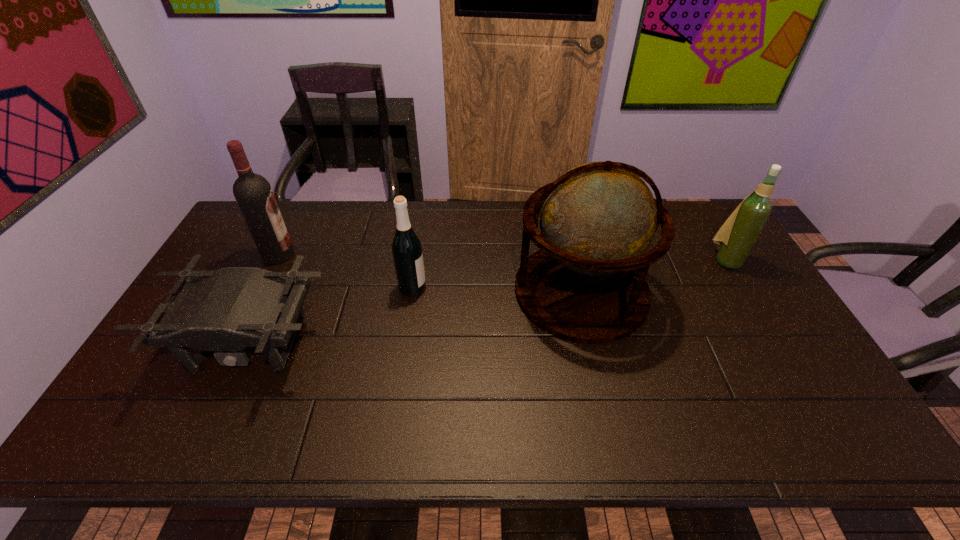
I want to click on vacant space situated 0.120m on the front-facing side of the rightmost wine bottle, so click(750, 300).

Image resolution: width=960 pixels, height=540 pixels. Identify the location of vacant space located 0.260m on the label of the third object from left to right. (513, 288).

Where is `wine bottle located at the left edge`? Image resolution: width=960 pixels, height=540 pixels. wine bottle located at the left edge is located at coordinates (253, 193).

Identify the location of drone present at the left edge. tap(226, 310).

The width and height of the screenshot is (960, 540). What are the coordinates of `object at the right edge` in the screenshot? It's located at (735, 239).

Where is `vacant space at the far edge`? This screenshot has height=540, width=960. vacant space at the far edge is located at coordinates click(455, 216).

In order to click on vacant space at the near edge in this screenshot , I will do `click(605, 415)`.

In the image, there is a desktop. Where is `vacant region at the left edge`? vacant region at the left edge is located at coordinates (251, 264).

Find the location of a particular element. This screenshot has width=960, height=540. vacant space at the right edge is located at coordinates (817, 399).

Where is `free space at the near left corner of the desktop`? free space at the near left corner of the desktop is located at coordinates (173, 432).